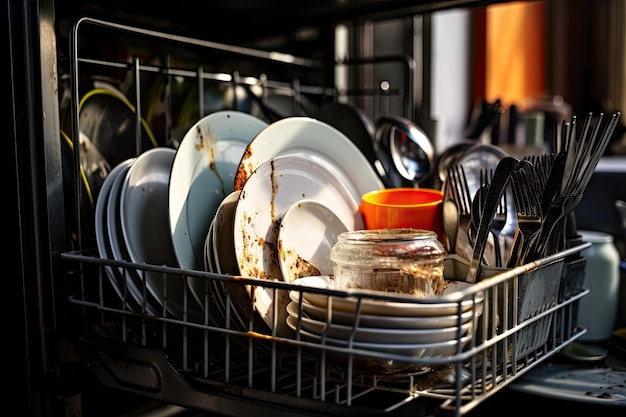
Identify every occurrence of dishes without food on them in the image. Your answer should be formatted as a list of tuples, i.e. [(x1, y1), (x2, y2), ...], where each tuple contains the x and y coordinates of a point satisfying the conditions above.

[(101, 241), (109, 240), (130, 236), (375, 306), (375, 321), (374, 334), (374, 348)]